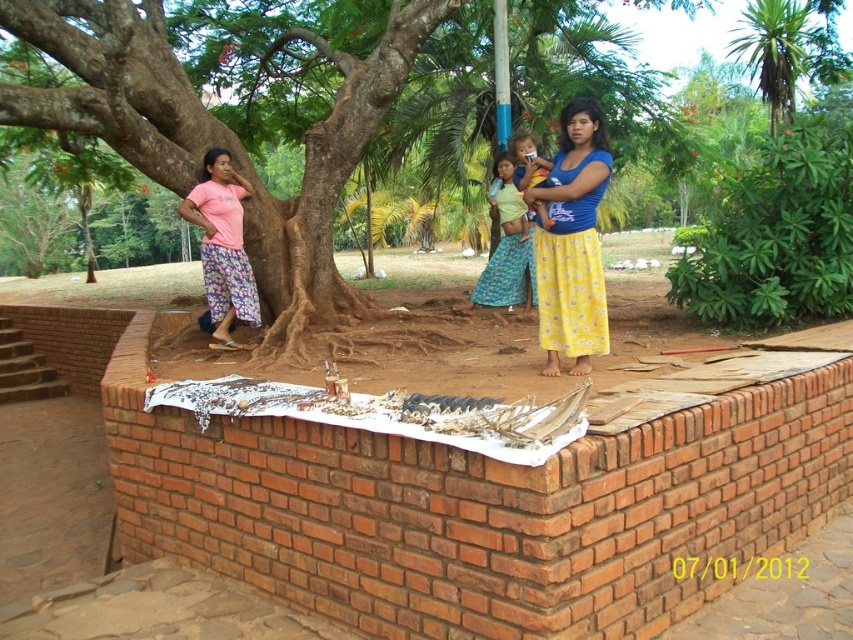
Does pink fabric pants at left appear over yellow fabric at center?

Incorrect, pink fabric pants at left is not positioned above yellow fabric at center.

Does pink fabric pants at left have a larger size compared to yellow fabric at center?

Indeed, pink fabric pants at left has a larger size compared to yellow fabric at center.

This screenshot has height=640, width=853. Find the location of `pink fabric pants at left`. pink fabric pants at left is located at coordinates (222, 246).

Who is higher up, brown rough tree at upper left or yellow fabric baby at center?

brown rough tree at upper left is higher up.

Who is shorter, brown rough tree at upper left or yellow fabric baby at center?

yellow fabric baby at center

This screenshot has height=640, width=853. Identify the location of brown rough tree at upper left. point(219,132).

Between point (589, 353) and point (515, 164), which one is positioned in front?

Point (589, 353) is in front.

Can you confirm if blue/yellow floral skirt at center is positioned to the left of yellow fabric baby at center?

Indeed, blue/yellow floral skirt at center is positioned on the left side of yellow fabric baby at center.

Is point (573, 333) in front of point (543, 220)?

No, (573, 333) is further to viewer.

Image resolution: width=853 pixels, height=640 pixels. What are the coordinates of `blue/yellow floral skirt at center` in the screenshot? It's located at (572, 241).